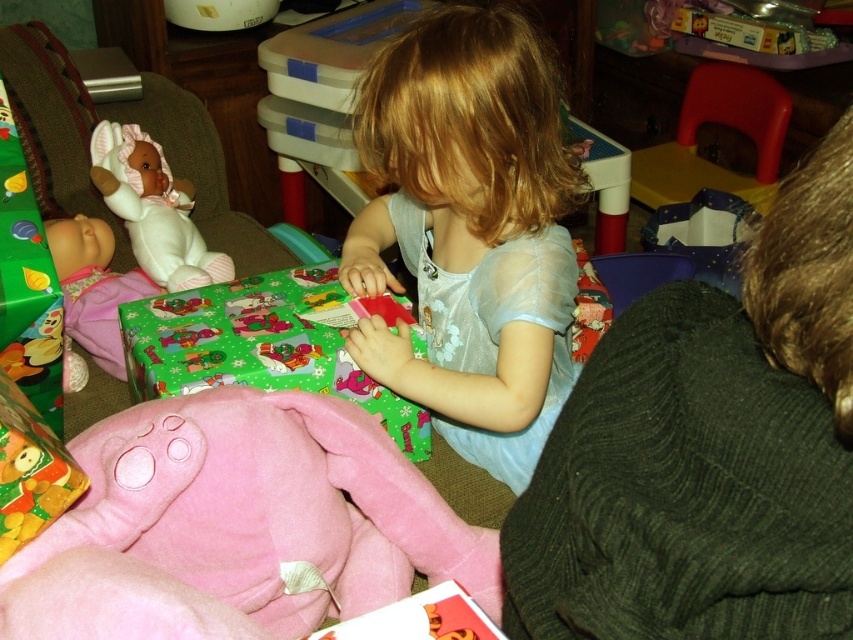
You are standing in the playroom and notice two points marked in the scene. Which point, point (161,360) or point (73,221), is closer to you?

Point (161,360) is closer to the viewer than point (73,221).

You are a parent trying to choose a toy for your child. You see the pink plush pig at lower left and the white plush baby doll at left. Which one is bigger?

The pink plush pig at lower left is larger in size than the white plush baby doll at left.

You are an interior designer analyzing the spatial layout of the room. The light blue sheer dress at center is placed at coordinates 0.362 on the x axis and 0.552 on the y axis. If the room has a coordinate system where the bottom left corner is the origin, what is the dress positioned relative to the center of the room?

The light blue sheer dress at center is positioned slightly to the left and below the center of the room since its coordinates are 0.362 on the x axis and 0.552 on the y axis. In a coordinate system with the origin at the bottom left, the center would be at approximately 0.5 on both axes. The x value of 0.362 is less than 0.5, indicating a leftward position, and the y value of 0.552 is slightly above 0.5, meaning it is just below the vertical center.